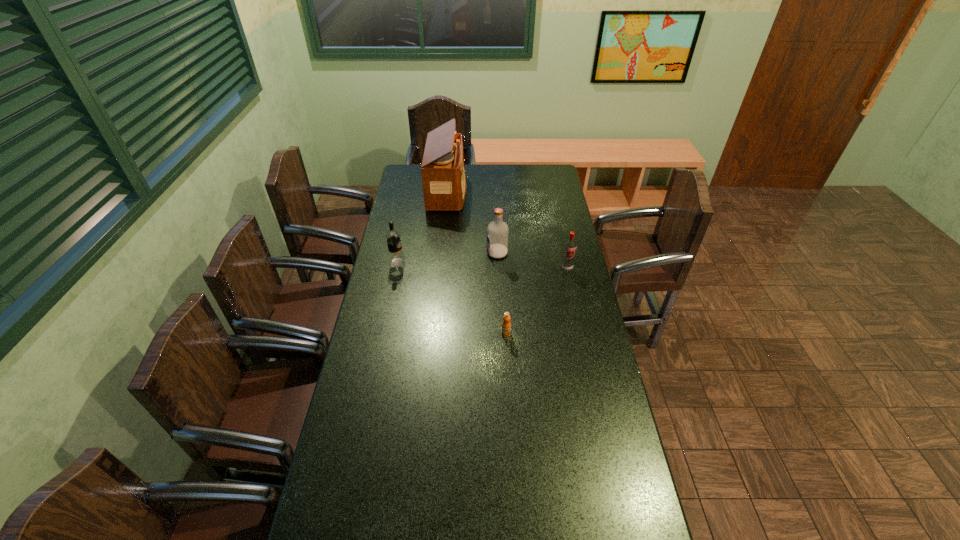
Find the location of a particular element. empty space that is in between the orange juice and the leftmost object is located at coordinates (452, 298).

Locate which object is the third closest to the second vodka from right to left. Please provide its 2D coordinates. Your answer should be formatted as a tuple, i.e. [(x, y)], where the tuple contains the x and y coordinates of a point satisfying the conditions above.

[(396, 258)]

This screenshot has width=960, height=540. What are the coordinates of `object that is the third closest to the tallest object` in the screenshot? It's located at (570, 245).

I want to click on vodka object that ranks as the closest to the radio receiver, so click(x=497, y=231).

Choose which vodka is the second nearest neighbor to the orange juice. Please provide its 2D coordinates. Your answer should be formatted as a tuple, i.e. [(x, y)], where the tuple contains the x and y coordinates of a point satisfying the conditions above.

[(497, 231)]